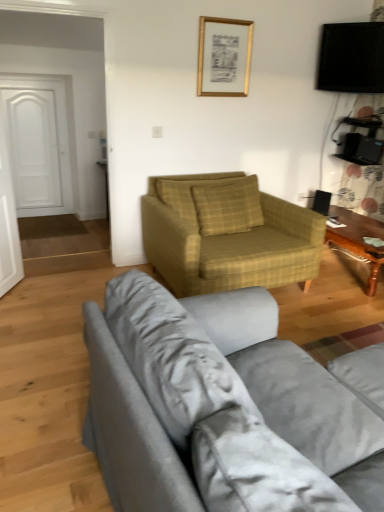
Question: Is yellow plaid pillow at center turned away from wooden polished coffee table at right?

Choices:
 (A) no
 (B) yes

Answer: (A)

Question: Is yellow plaid pillow at center thinner than wooden polished coffee table at right?

Choices:
 (A) no
 (B) yes

Answer: (B)

Question: Can you confirm if yellow plaid pillow at center is smaller than wooden polished coffee table at right?

Choices:
 (A) no
 (B) yes

Answer: (B)

Question: From the image's perspective, is yellow plaid pillow at center located beneath wooden polished coffee table at right?

Choices:
 (A) yes
 (B) no

Answer: (B)

Question: Does yellow plaid pillow at center have a greater height compared to wooden polished coffee table at right?

Choices:
 (A) no
 (B) yes

Answer: (B)

Question: Is yellow plaid pillow at center behind wooden polished coffee table at right?

Choices:
 (A) yes
 (B) no

Answer: (B)

Question: Does wooden polished coffee table at right appear on the left side of yellow plaid fabric armchair at center?

Choices:
 (A) yes
 (B) no

Answer: (B)

Question: Can you confirm if wooden polished coffee table at right is smaller than yellow plaid fabric armchair at center?

Choices:
 (A) no
 (B) yes

Answer: (B)

Question: Does wooden polished coffee table at right have a larger size compared to yellow plaid fabric armchair at center?

Choices:
 (A) no
 (B) yes

Answer: (A)

Question: Considering the relative positions of wooden polished coffee table at right and yellow plaid fabric armchair at center in the image provided, is wooden polished coffee table at right behind yellow plaid fabric armchair at center?

Choices:
 (A) no
 (B) yes

Answer: (B)

Question: From the image's perspective, is wooden polished coffee table at right above yellow plaid fabric armchair at center?

Choices:
 (A) no
 (B) yes

Answer: (A)

Question: From the image's perspective, is wooden polished coffee table at right below yellow plaid fabric armchair at center?

Choices:
 (A) no
 (B) yes

Answer: (B)

Question: Is yellow plaid pillow at center looking in the opposite direction of black glossy tv at upper right?

Choices:
 (A) no
 (B) yes

Answer: (A)